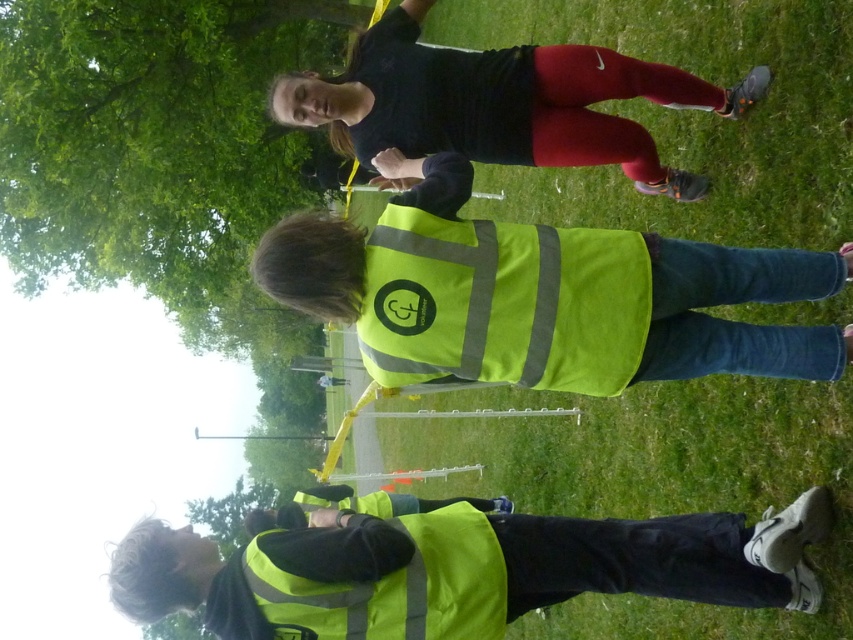
Can you confirm if matte black shirt at upper center is shorter than high-visibility fabric safety vest at lower center?

In fact, matte black shirt at upper center may be taller than high-visibility fabric safety vest at lower center.

Which of these two, matte black shirt at upper center or high-visibility fabric safety vest at lower center, stands shorter?

high-visibility fabric safety vest at lower center

Is point (498, 56) farther from camera compared to point (483, 541)?

That is True.

Where is `matte black shirt at upper center`? This screenshot has height=640, width=853. matte black shirt at upper center is located at coordinates (500, 104).

Based on the photo, who is more distant from viewer, (x=372, y=259) or (x=364, y=122)?

Positioned behind is point (x=364, y=122).

Which of these two, high-visibility fabric safety vest at center or matte black shirt at upper center, stands shorter?

Standing shorter between the two is high-visibility fabric safety vest at center.

Where is `high-visibility fabric safety vest at center`? This screenshot has height=640, width=853. high-visibility fabric safety vest at center is located at coordinates (503, 304).

Which of these two, neon yellow reflective vest at center or high visibility vest at lower center, stands shorter?

high visibility vest at lower center is shorter.

Who is lower down, neon yellow reflective vest at center or high visibility vest at lower center?

high visibility vest at lower center is below.

Which is in front, point (514, 280) or point (515, 522)?

Point (514, 280)

This screenshot has width=853, height=640. I want to click on neon yellow reflective vest at center, so click(543, 296).